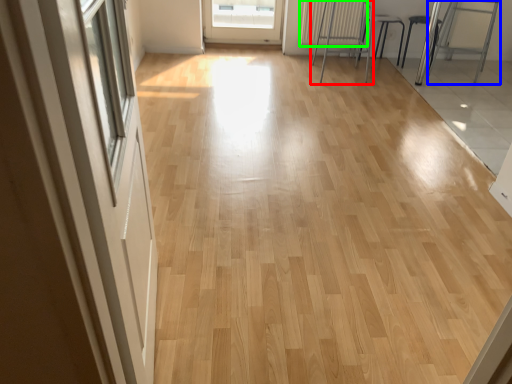
Question: Which object is the farthest from furniture (highlighted by a red box)? Choose among these: armchair (highlighted by a blue box) or radiator (highlighted by a green box).

Choices:
 (A) armchair
 (B) radiator

Answer: (A)